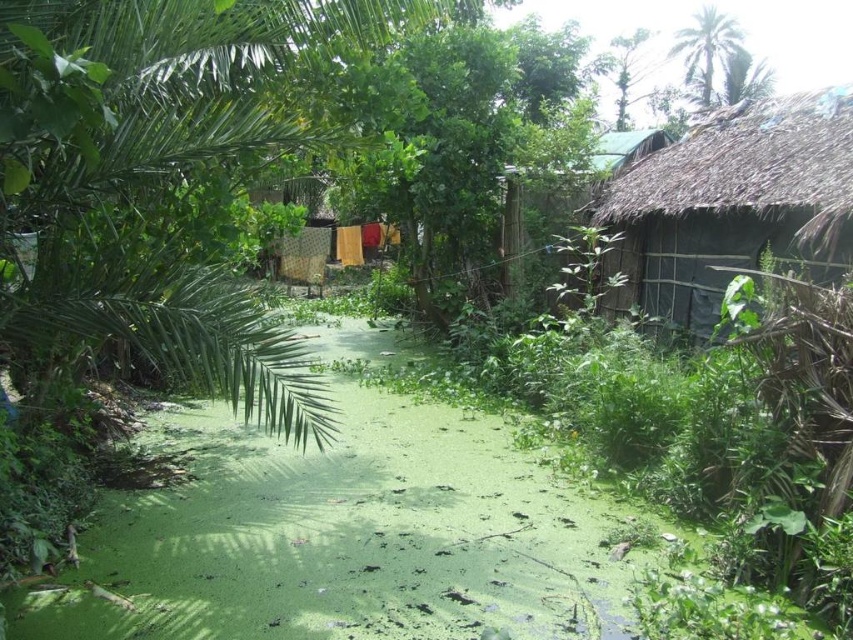
Which is in front, point (763, 224) or point (585, 170)?

Point (763, 224) is in front.

Can you confirm if thatched roof hut at right is wider than green thatched hut at upper right?

Indeed, thatched roof hut at right has a greater width compared to green thatched hut at upper right.

Is point (683, 218) closer to camera compared to point (614, 161)?

That is True.

This screenshot has width=853, height=640. In order to click on thatched roof hut at right in this screenshot , I will do `click(724, 200)`.